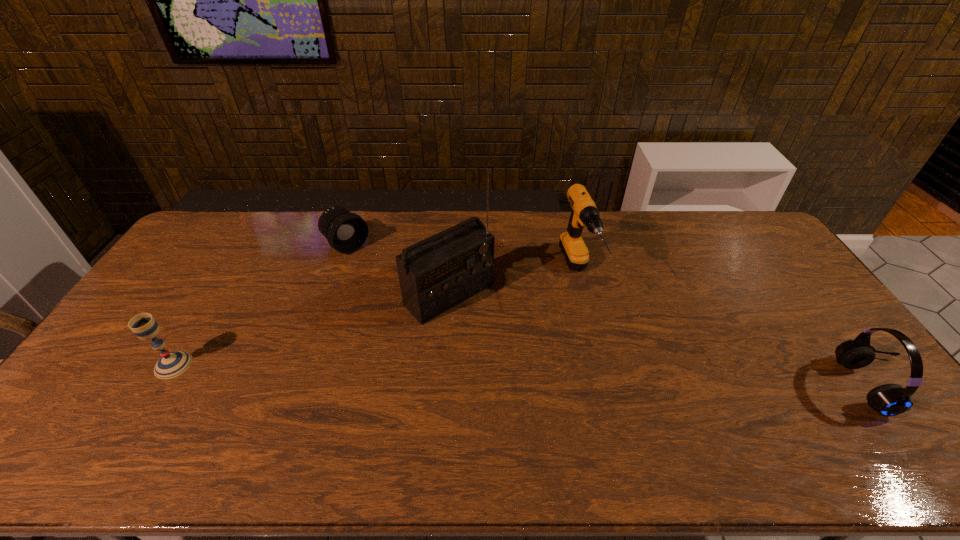
Find the location of `vacant space that satisfies the following two spatial constraints: 1. on the back side of the chalice; 2. on the left side of the fourth object from right to left`. vacant space that satisfies the following two spatial constraints: 1. on the back side of the chalice; 2. on the left side of the fourth object from right to left is located at coordinates (247, 245).